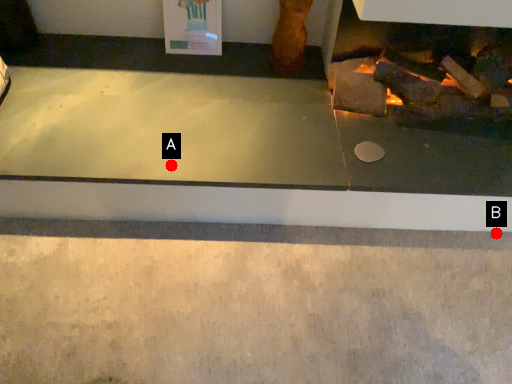
Question: Two points are circled on the image, labeled by A and B beside each circle. Among these points, which one is nearest to the camera?

Choices:
 (A) A is closer
 (B) B is closer

Answer: (A)